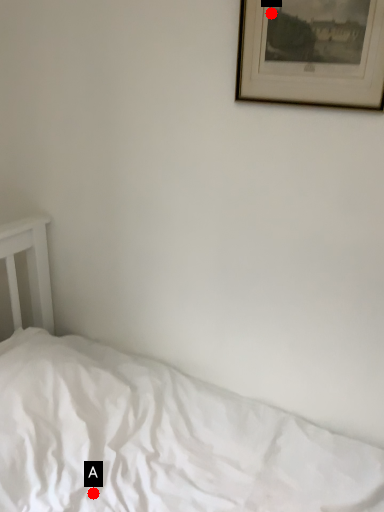
Question: Two points are circled on the image, labeled by A and B beside each circle. Which of the following is the farthest from the observer?

Choices:
 (A) A is further
 (B) B is further

Answer: (A)